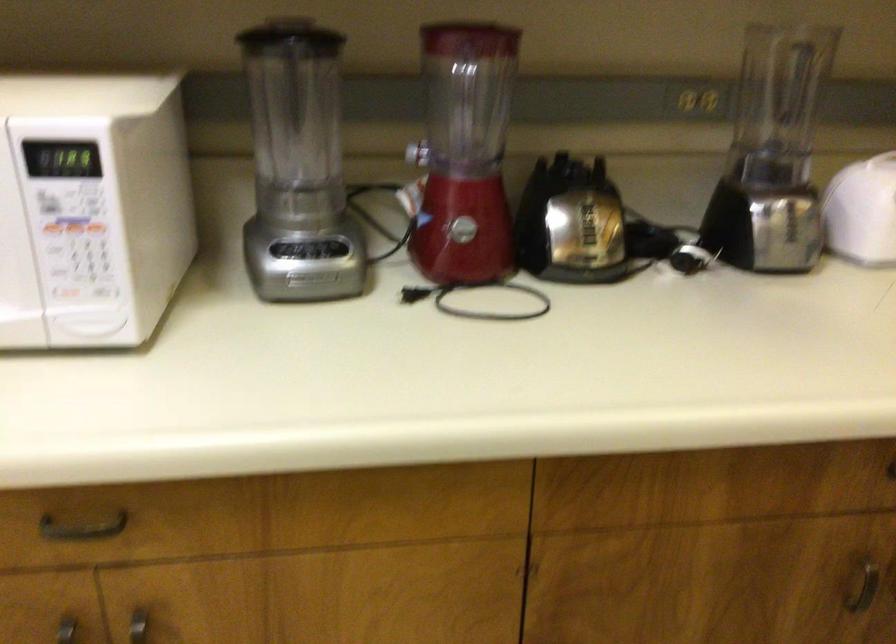
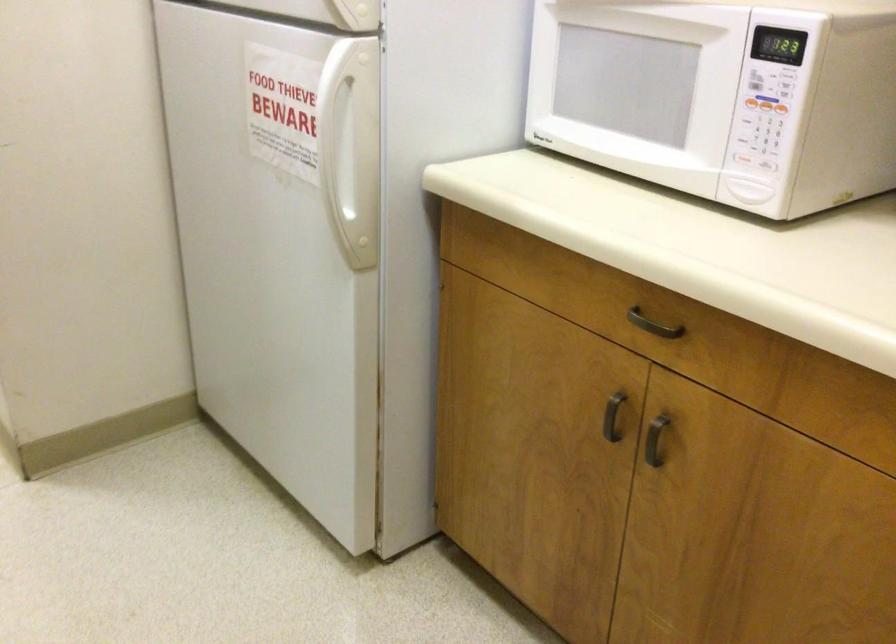
In the second image, find the point that corresponds to point 101,292 in the first image.

(764, 164)